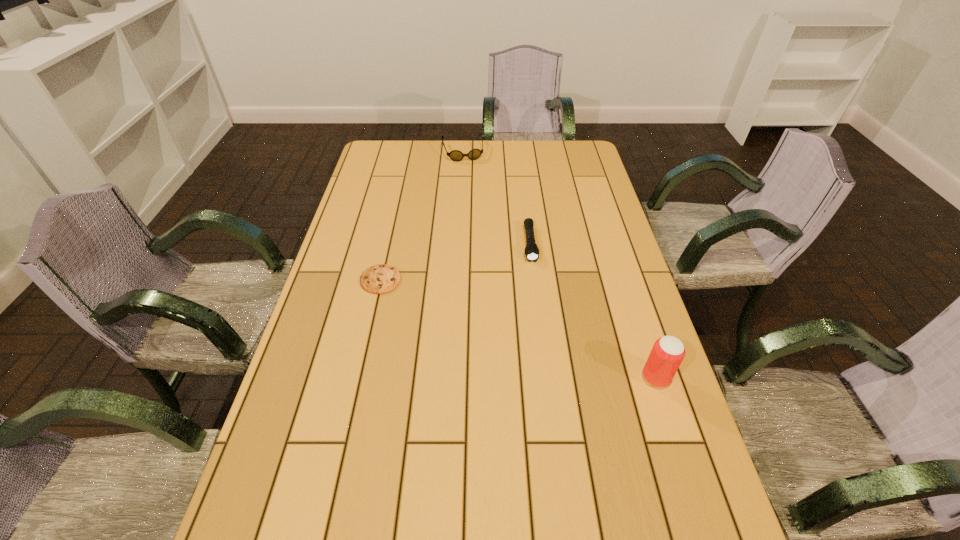
Find the location of a particular element. the shortest object is located at coordinates (382, 278).

What are the coordinates of `the leftmost object` in the screenshot? It's located at (382, 278).

At what (x,y) coordinates should I click in order to perform the action: click on the rightmost object. Please return your answer as a coordinate pair (x, y). This screenshot has width=960, height=540. Looking at the image, I should click on (668, 352).

Image resolution: width=960 pixels, height=540 pixels. Identify the location of the nearest object. (668, 352).

Locate an element on the screen. sunglasses is located at coordinates (455, 155).

This screenshot has width=960, height=540. I want to click on the farthest object, so click(455, 155).

You are a GUI agent. You are given a task and a screenshot of the screen. Output one action in this format:
    pyautogui.click(x=<x>, y=<y>)
    Task: Click on the second object from right to left
    The image size is (960, 540).
    Given the screenshot: What is the action you would take?
    pyautogui.click(x=531, y=250)

You are a GUI agent. You are given a task and a screenshot of the screen. Output one action in this format:
    pyautogui.click(x=<x>, y=<y>)
    Task: Click on the flashlight
    The width and height of the screenshot is (960, 540).
    Given the screenshot: What is the action you would take?
    pyautogui.click(x=531, y=250)

Image resolution: width=960 pixels, height=540 pixels. In order to click on vacant region located on the front of the leftmost object in this screenshot , I will do `click(364, 354)`.

You are a GUI agent. You are given a task and a screenshot of the screen. Output one action in this format:
    pyautogui.click(x=<x>, y=<y>)
    Task: Click on the vacant region located 0.380m on the left of the beer can
    The width and height of the screenshot is (960, 540).
    Given the screenshot: What is the action you would take?
    pyautogui.click(x=482, y=377)